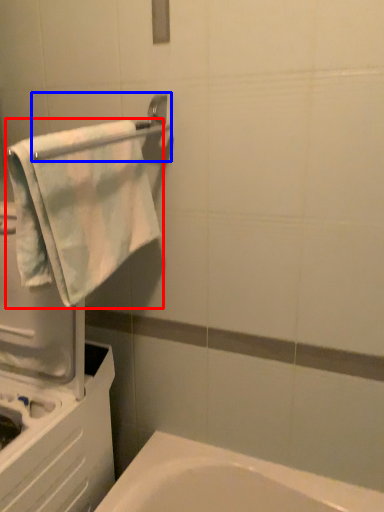
Question: Among these objects, which one is nearest to the camera, towel (highlighted by a red box) or towel bar (highlighted by a blue box)?

Choices:
 (A) towel
 (B) towel bar

Answer: (B)